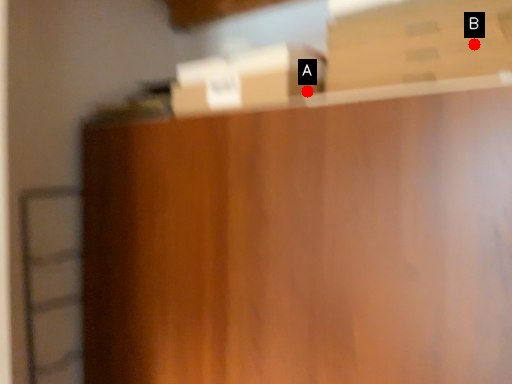
Question: Two points are circled on the image, labeled by A and B beside each circle. Which point is farther from the camera taking this photo?

Choices:
 (A) A is further
 (B) B is further

Answer: (A)